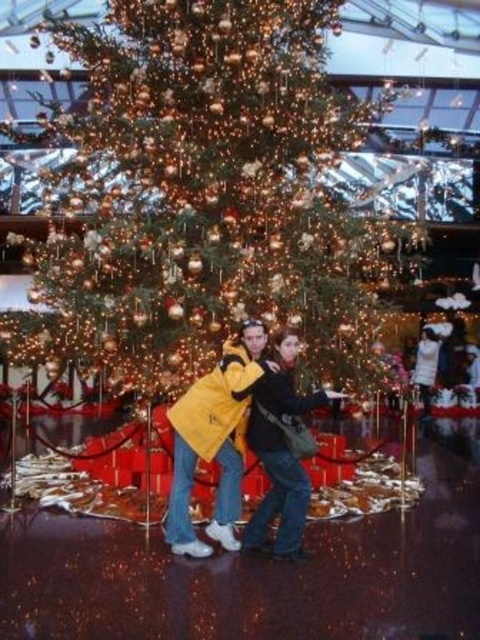
Looking at this image, is shiny gold ornaments at center above yellow matte jacket at center?

Yes, shiny gold ornaments at center is above yellow matte jacket at center.

Does point (211, 58) come in front of point (216, 433)?

No, it is not.

Locate an element on the screen. The width and height of the screenshot is (480, 640). shiny gold ornaments at center is located at coordinates (212, 196).